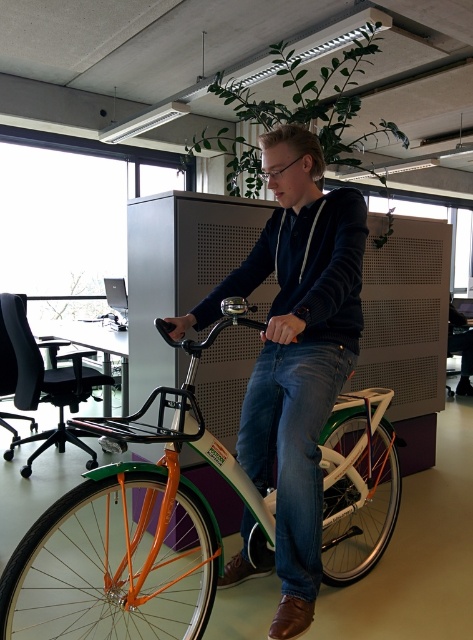
Which is in front, point (41, 605) or point (306, 440)?

Point (306, 440) is more forward.

Which is in front, point (87, 513) or point (282, 609)?

Point (282, 609) is more forward.

You are a GUI agent. You are given a task and a screenshot of the screen. Output one action in this format:
    pyautogui.click(x=<x>, y=<y>)
    Task: Click on the orange matte bicycle at center
    This screenshot has width=473, height=640.
    Given the screenshot: What is the action you would take?
    pyautogui.click(x=130, y=532)